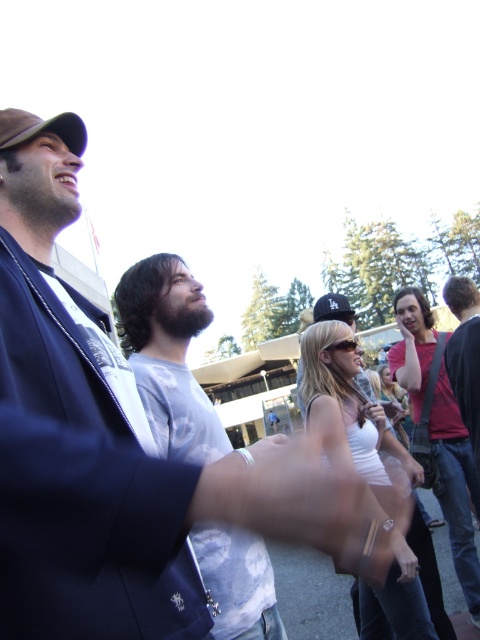
Can you confirm if matte red shirt at right is smaller than brown fabric baseball cap at upper left?

Correct, matte red shirt at right occupies less space than brown fabric baseball cap at upper left.

Is matte red shirt at right bigger than brown fabric baseball cap at upper left?

Incorrect, matte red shirt at right is not larger than brown fabric baseball cap at upper left.

Does point (393, 378) lie behind point (23, 113)?

Yes, it is.

Find the location of `matte red shirt at right`. matte red shirt at right is located at coordinates (456, 483).

What do you see at coordinates (465, 355) in the screenshot? I see `dark red shirt at right` at bounding box center [465, 355].

Does dark red shirt at right appear on the right side of matte black sunglasses at center?

Yes, dark red shirt at right is to the right of matte black sunglasses at center.

This screenshot has width=480, height=640. What do you see at coordinates (465, 355) in the screenshot?
I see `dark red shirt at right` at bounding box center [465, 355].

You are a GUI agent. You are given a task and a screenshot of the screen. Output one action in this format:
    pyautogui.click(x=<x>, y=<y>)
    Task: Click on the dark red shirt at right
    
    Given the screenshot: What is the action you would take?
    pyautogui.click(x=465, y=355)

Between gray cotton t-shirt at center and matte red shirt at right, which one is positioned higher?

gray cotton t-shirt at center

Does gray cotton t-shirt at center appear over matte red shirt at right?

→ Correct, gray cotton t-shirt at center is located above matte red shirt at right.

Locate an element on the screen. This screenshot has width=480, height=640. gray cotton t-shirt at center is located at coordinates (168, 355).